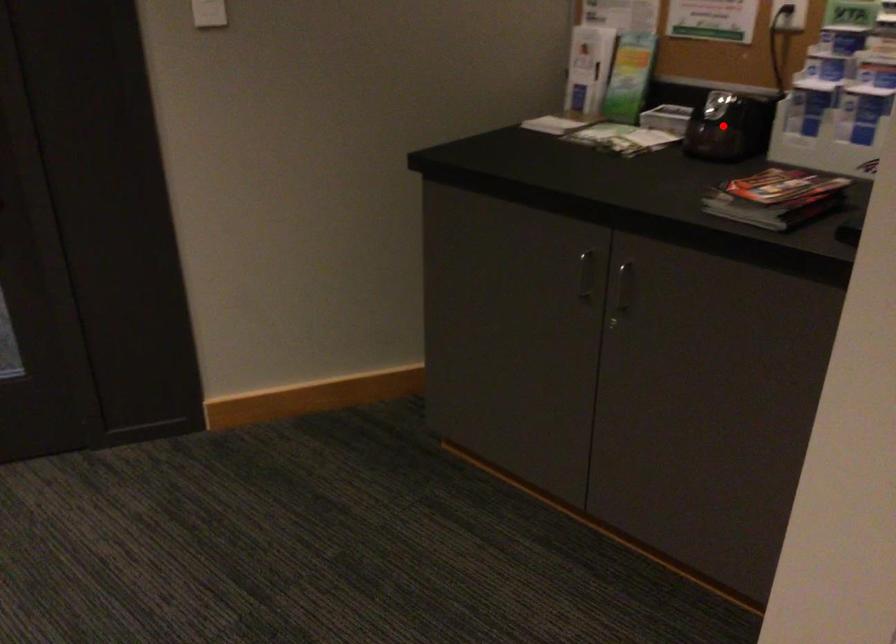
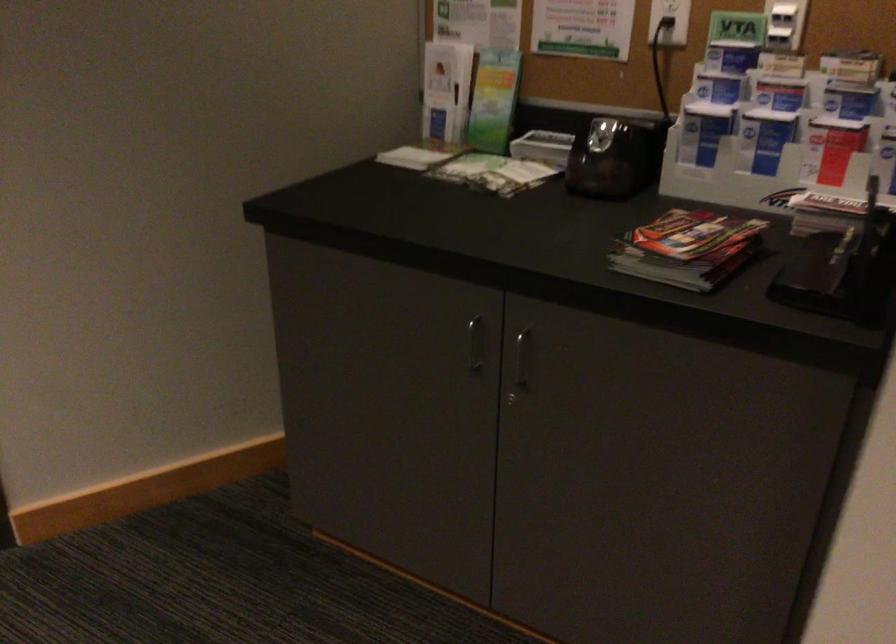
Question: I am providing you with two images of the same scene from different viewpoints. A red point is shown in image1. For the corresponding object point in image2, is it positioned nearer or farther from the camera?

Choices:
 (A) Nearer
 (B) Farther

Answer: (A)